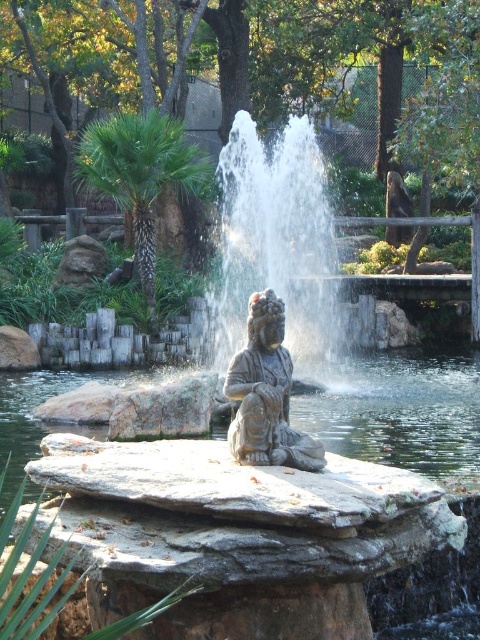
Does gray stone water at center have a smaller size compared to slate gray stone fountain at center?

Yes.

Who is positioned more to the right, gray stone water at center or slate gray stone fountain at center?

slate gray stone fountain at center is more to the right.

Between point (429, 424) and point (268, 237), which one is positioned behind?

The point (268, 237) is more distant.

Find the location of a particular element. gray stone water at center is located at coordinates (402, 412).

Can you confirm if gray stone water at center is positioned to the left of matte stone statue at center?

Yes, gray stone water at center is to the left of matte stone statue at center.

Is gray stone water at center closer to camera compared to matte stone statue at center?

No, it is behind matte stone statue at center.

Is point (379, 460) positioned in front of point (307, 456)?

No, (379, 460) is behind (307, 456).

Identify the location of gray stone water at center. (402, 412).

Is point (252, 129) positioned in front of point (290, 435)?

That is False.

Locate an element on the screen. The width and height of the screenshot is (480, 640). slate gray stone fountain at center is located at coordinates (276, 240).